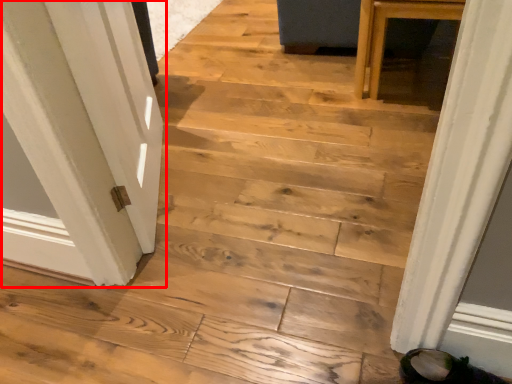
Question: From the image's perspective, where is door (annotated by the red box) located in relation to footwear in the image?

Choices:
 (A) below
 (B) above

Answer: (B)